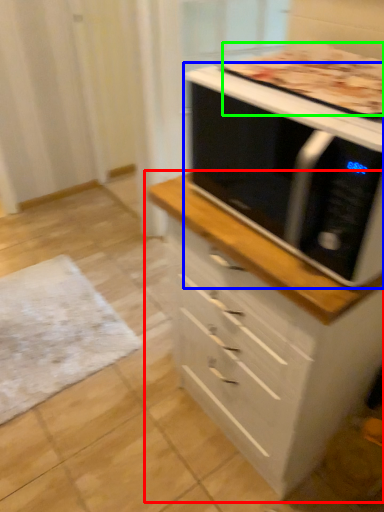
Question: Which object is positioned closest to chest of drawers (highlighted by a red box)? Select from microwave oven (highlighted by a blue box) and pizza (highlighted by a green box).

Choices:
 (A) microwave oven
 (B) pizza

Answer: (A)